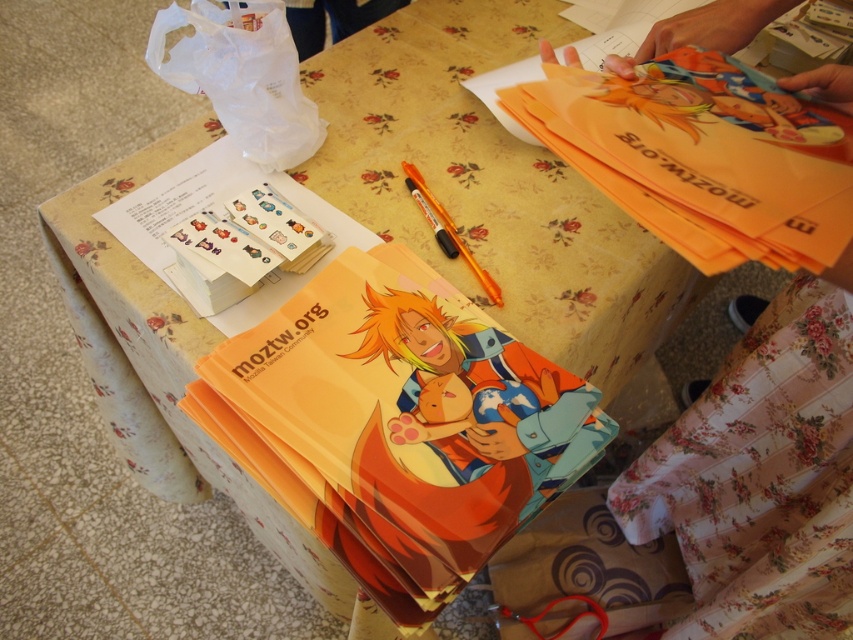
You need to choose between the orange plastic pen at center and the metallic orange scissors at lower center to place into a narrow pencil case. Which one will fit better?

The orange plastic pen at center has a smaller width than the metallic orange scissors at lower center, so it will fit better in the narrow pencil case.

You are organizing a craft project and need to know the position of the orange plastic pen at center relative to the metallic orange scissors at lower center. Which object is positioned to the left?

The orange plastic pen at center is positioned to the left of the metallic orange scissors at lower center.

You are standing at the edge of the table and want to reach the two points on the table. Which point is closer to you, point at coordinate (490, 276) or point at coordinate (566, 596)?

Point at coordinate (490, 276) is in front of point at coordinate (566, 596), so it is closer to you.